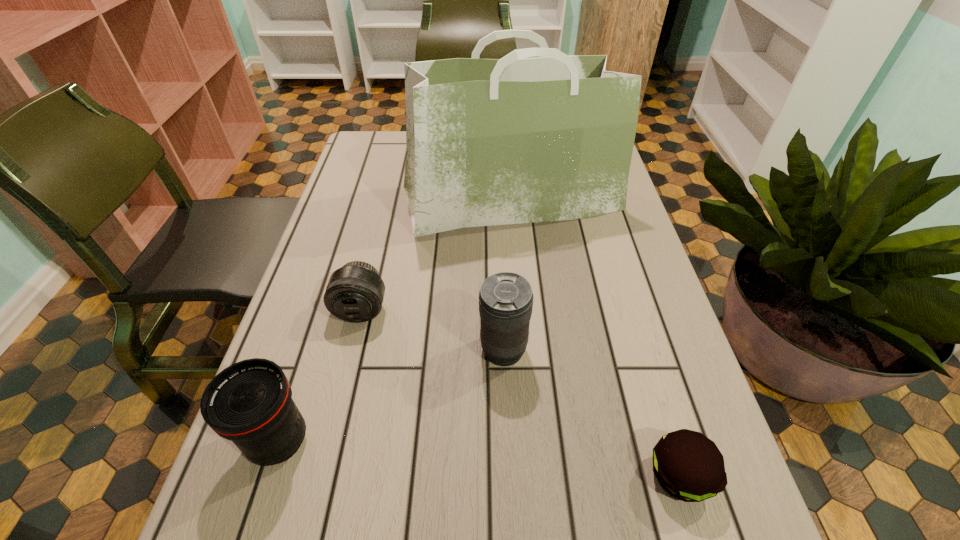
Identify the location of vacant point located on the side of the rightmost telephoto lens where the control switches are located. (333, 350).

What are the coordinates of `vacant space located 0.090m on the side of the rightmost telephoto lens where the control switches are located` in the screenshot? It's located at (434, 350).

Locate an element on the screen. This screenshot has width=960, height=540. vacant space located on the back of the nearest telephoto lens is located at coordinates (301, 371).

This screenshot has width=960, height=540. Identify the location of vacant space located 0.170m on the front-facing side of the second farthest object. (339, 402).

Locate an element on the screen. free space located on the left of the shortest object is located at coordinates (447, 475).

Find the location of `object that is at the far edge`. object that is at the far edge is located at coordinates (503, 141).

Where is `grocery bag at the right edge`? This screenshot has height=540, width=960. grocery bag at the right edge is located at coordinates (503, 141).

The height and width of the screenshot is (540, 960). Find the location of `patty located at the right edge`. patty located at the right edge is located at coordinates (689, 466).

Where is `object that is positioned at the far right corner`? object that is positioned at the far right corner is located at coordinates (503, 141).

You are a GUI agent. You are given a task and a screenshot of the screen. Output one action in this format:
    pyautogui.click(x=<x>, y=<y>)
    Task: Click on the vacant space at the left edge of the desktop
    This screenshot has width=960, height=540.
    Given the screenshot: What is the action you would take?
    pyautogui.click(x=324, y=249)